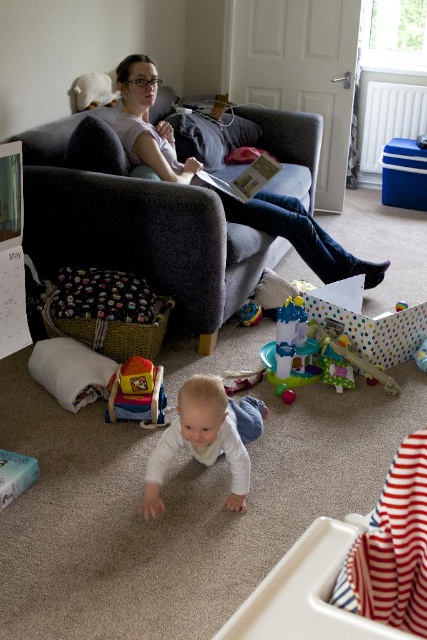
Question: Estimate the real-world distances between objects in this image. Which object is farther from the white soft baby at center?

Choices:
 (A) matte gray couch at upper center
 (B) dark gray fabric couch at upper center
 (C) matte plastic toy at lower center

Answer: (A)

Question: From the image, what is the correct spatial relationship of dark gray fabric couch at upper center in relation to matte gray couch at upper center?

Choices:
 (A) above
 (B) below

Answer: (B)

Question: Which object appears closest to the camera in this image?

Choices:
 (A) dark gray fabric couch at upper center
 (B) white soft baby at center
 (C) matte gray couch at upper center

Answer: (B)

Question: Can you confirm if matte gray couch at upper center is positioned below white soft baby at center?

Choices:
 (A) no
 (B) yes

Answer: (A)

Question: Which of the following is the farthest from the observer?

Choices:
 (A) (108, 387)
 (B) (166, 179)
 (C) (256, 253)
 (D) (210, 401)

Answer: (C)

Question: Can you confirm if dark gray fabric couch at upper center is positioned to the right of matte plastic toy at lower center?

Choices:
 (A) yes
 (B) no

Answer: (B)